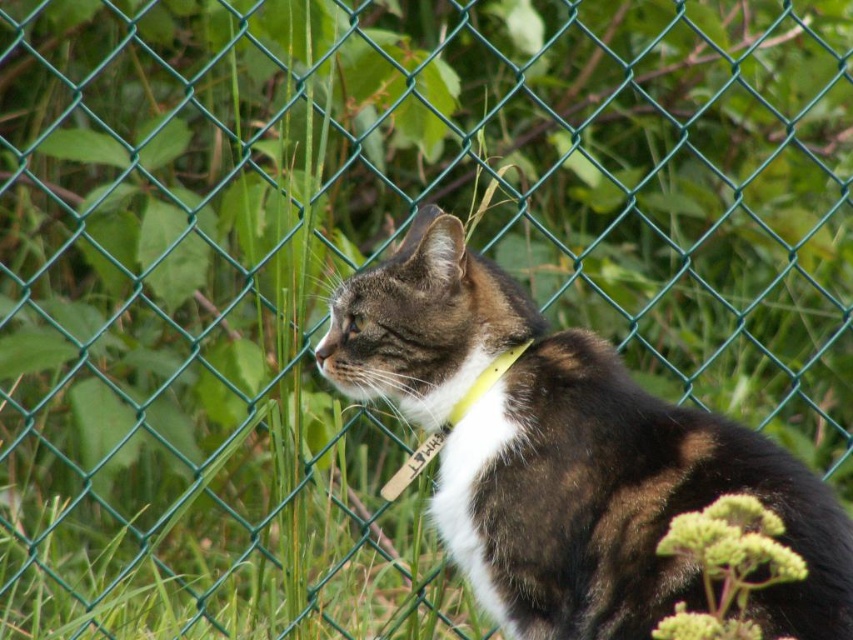
Does tabby fur cat at center have a greater width compared to green fuzzy plant at lower right?

Correct, the width of tabby fur cat at center exceeds that of green fuzzy plant at lower right.

Between tabby fur cat at center and green fuzzy plant at lower right, which one is positioned lower?

green fuzzy plant at lower right

Does point (550, 499) lie behind point (717, 582)?

Yes.

The width and height of the screenshot is (853, 640). What are the coordinates of `tabby fur cat at center` in the screenshot? It's located at (566, 456).